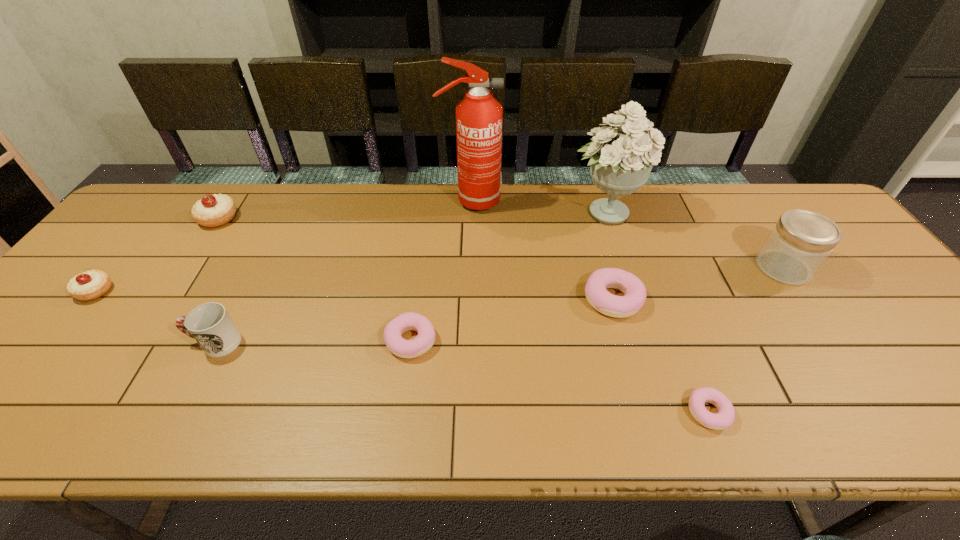
At what (x,y) coordinates should I click in order to perform the action: click on the tallest object. Please return your answer as a coordinate pair (x, y). Looking at the image, I should click on (478, 116).

The height and width of the screenshot is (540, 960). I want to click on red fire extinguisher, so click(478, 116).

The image size is (960, 540). I want to click on bouquet, so click(620, 164).

Image resolution: width=960 pixels, height=540 pixels. I want to click on green bouquet, so click(620, 164).

At what (x,y) coordinates should I click in order to perform the action: click on the rightmost object. Please return your answer as a coordinate pair (x, y). This screenshot has height=540, width=960. Looking at the image, I should click on (801, 241).

At what (x,y) coordinates should I click in order to perform the action: click on jar. Please return your answer as a coordinate pair (x, y). Looking at the image, I should click on (801, 241).

This screenshot has width=960, height=540. In order to click on the seventh object from right to left in this screenshot , I will do `click(209, 324)`.

In order to click on red cup in this screenshot , I will do `click(209, 324)`.

Where is `the second object from left to right`? The width and height of the screenshot is (960, 540). the second object from left to right is located at coordinates (216, 210).

The height and width of the screenshot is (540, 960). I want to click on the farthest pastry, so click(216, 210).